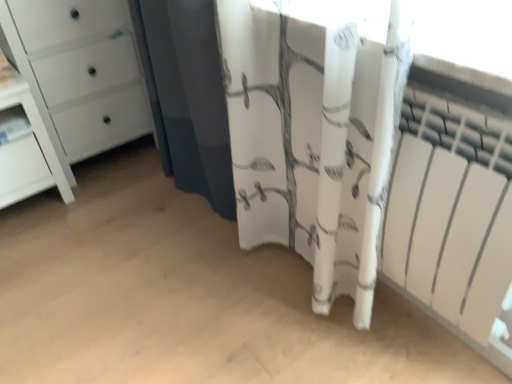
Locate an element on the screen. free space that is in between white floral fabric at center and white glossy chest of drawers at left is located at coordinates (142, 195).